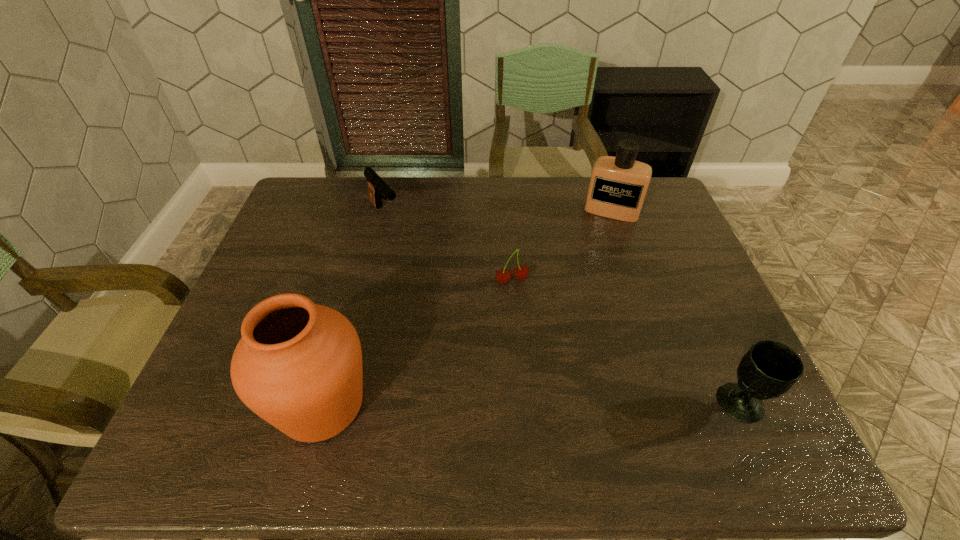
Identify the location of free spot between the perfume and the fourth tallest object. (498, 212).

Where is `empty space between the chalice and the urn`? Image resolution: width=960 pixels, height=540 pixels. empty space between the chalice and the urn is located at coordinates (531, 404).

At what (x,y) coordinates should I click in order to perform the action: click on free spot between the third nearest object and the pistol. Please return your answer as a coordinate pair (x, y). The image size is (960, 540). Looking at the image, I should click on (448, 247).

Locate which object ranks fourth in proximity to the second shortest object. Please provide its 2D coordinates. Your answer should be formatted as a tuple, i.e. [(x, y)], where the tuple contains the x and y coordinates of a point satisfying the conditions above.

[(769, 369)]

Point out which object is positioned as the nearest to the urn. Please provide its 2D coordinates. Your answer should be formatted as a tuple, i.e. [(x, y)], where the tuple contains the x and y coordinates of a point satisfying the conditions above.

[(521, 272)]

Locate an element on the screen. Image resolution: width=960 pixels, height=540 pixels. vacant space that satisfies the following two spatial constraints: 1. on the back side of the cherry; 2. on the left side of the tallest object is located at coordinates (355, 281).

Find the location of `free space in the image that satisfies the following two spatial constraints: 1. on the front side of the third object from left to right; 2. on the left side of the pistol`. free space in the image that satisfies the following two spatial constraints: 1. on the front side of the third object from left to right; 2. on the left side of the pistol is located at coordinates (369, 281).

At what (x,y) coordinates should I click in order to perform the action: click on vacant space that satisfies the following two spatial constraints: 1. on the back side of the third object from right to left; 2. on the right side of the urn. Please return your answer as a coordinate pair (x, y). This screenshot has height=540, width=960. Looking at the image, I should click on (355, 281).

You are a GUI agent. You are given a task and a screenshot of the screen. Output one action in this format:
    pyautogui.click(x=<x>, y=<y>)
    Task: Click on the free space that satisfies the following two spatial constraints: 1. on the back side of the urn; 2. on the right side of the perfume
    
    Given the screenshot: What is the action you would take?
    pyautogui.click(x=374, y=211)